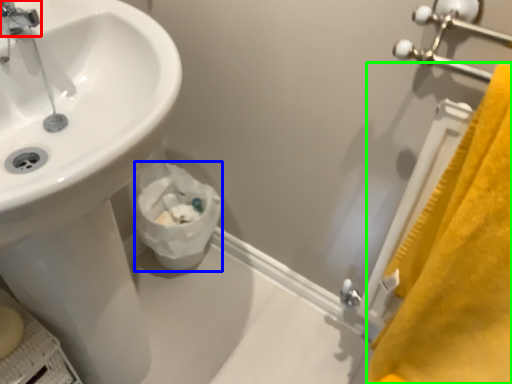
Question: Which object is positioned closest to tap (highlighted by a red box)? Select from toilet paper (highlighted by a blue box) and bath towel (highlighted by a green box).

Choices:
 (A) toilet paper
 (B) bath towel

Answer: (A)